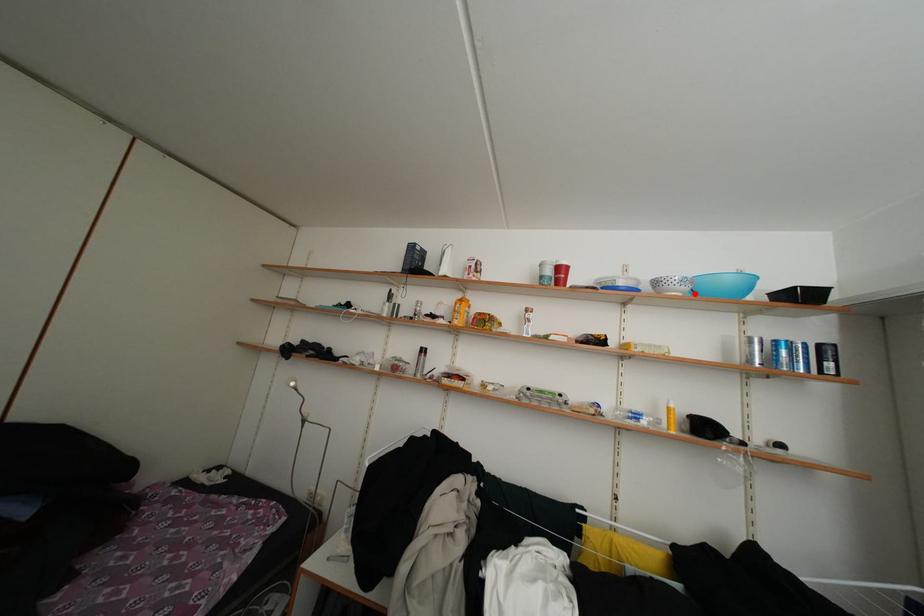
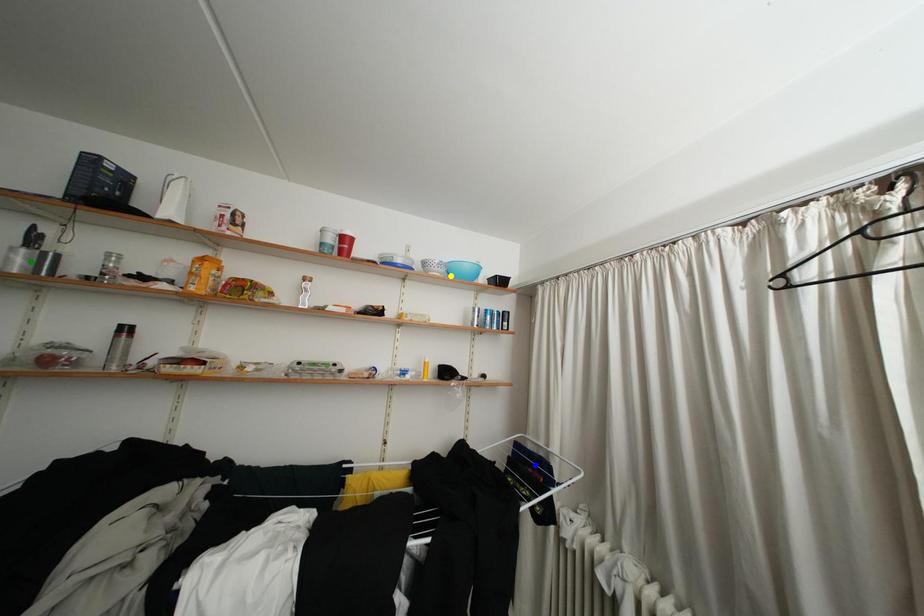
Question: I am providing you with two images of the same scene from different viewpoints. A red point is marked on the first image. You are given multiple points on the second image. Which mark in image 2 goes with the point in image 1?

Choices:
 (A) blue point
 (B) green point
 (C) yellow point

Answer: (C)